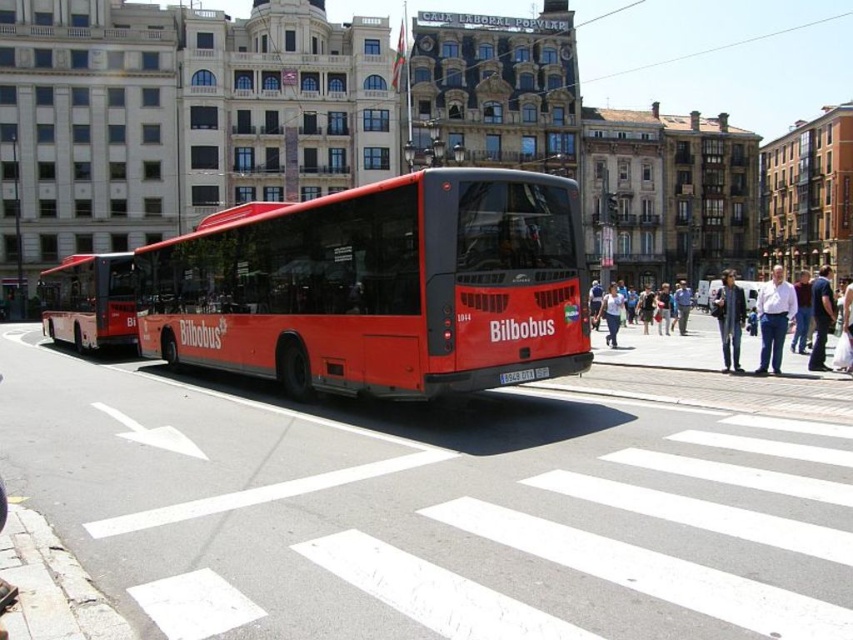
Question: Which of the following is the closest to the observer?

Choices:
 (A) (753, 348)
 (B) (337, 346)
 (C) (97, 268)
 (D) (788, 284)

Answer: (B)

Question: Which object is the farthest from the denim jacket at center?

Choices:
 (A) matte red bus at center
 (B) matte red bus at left
 (C) light blue jeans at center
 (D) matte black people at center

Answer: (B)

Question: Does matte black people at center have a smaller size compared to denim jacket at center?

Choices:
 (A) no
 (B) yes

Answer: (B)

Question: Is matte red bus at center to the right of light blue jeans at center from the viewer's perspective?

Choices:
 (A) no
 (B) yes

Answer: (A)

Question: Estimate the real-world distances between objects in this image. Which object is farther from the matte red bus at center?

Choices:
 (A) denim jacket at center
 (B) light blue jeans at center

Answer: (B)

Question: Can you confirm if matte red bus at left is positioned to the right of matte black people at center?

Choices:
 (A) yes
 (B) no

Answer: (B)